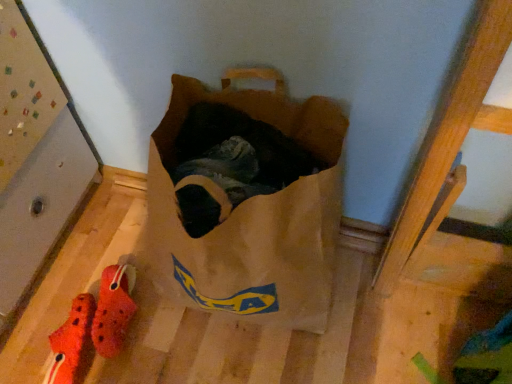
Locate an element on the screen. Image resolution: width=512 pixels, height=384 pixels. vacant area that is situated to the right of orange fabric slipper at lower left, acting as the second footwear starting from the right is located at coordinates (156, 346).